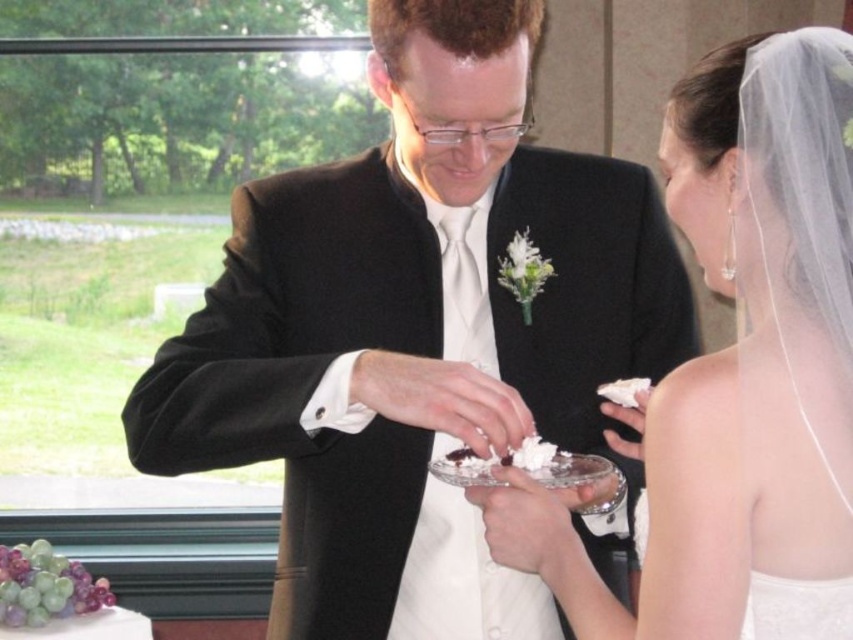
Based on the scene description, which object is taller between the black satin suit at center and the white satin dress at center?

The black satin suit at center is much taller than the white satin dress at center.

Based on the scene description, which object is larger in size between the black satin suit at center and the white satin dress at center?

The black satin suit at center is larger in size than the white satin dress at center according to the description.

You are a photographer at a wedding and need to capture a closeup shot of the cake. The white frosted cake at lower left and the white fluffy frosting at center are both in the frame. Which object should you focus on if you want to highlight the cake itself?

The white frosted cake at lower left is the actual cake, so focusing on it would highlight the cake itself. The white fluffy frosting at center is likely part of the cake or a decorative element on top.